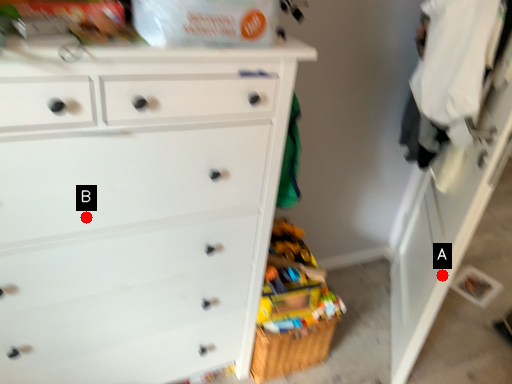
Question: Two points are circled on the image, labeled by A and B beside each circle. Which point appears closest to the camera in this image?

Choices:
 (A) A is closer
 (B) B is closer

Answer: (B)